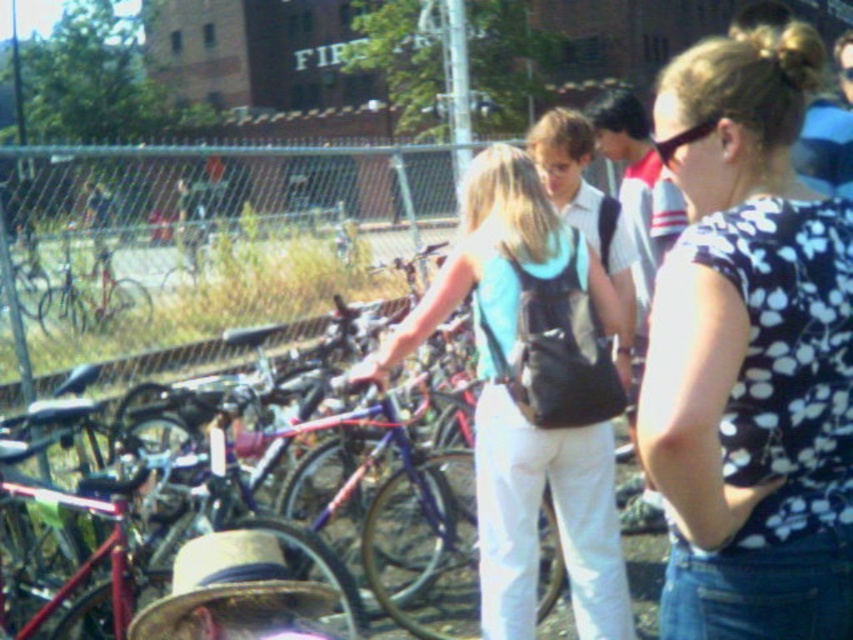
You are standing in the outdoor scene and see the floral print shirt at center and the light blue fabric backpack at center. Which item is positioned higher relative to the other?

The floral print shirt at center is above the light blue fabric backpack at center, so it is positioned higher.

You are standing at the point closest to the camera in the scene. There are two points marked in the image, one at coordinates point (x=509, y=480) and the other at point (x=279, y=620). Which point are you currently standing at?

You are standing at point (x=279, y=620) because it is closer to the camera than point (x=509, y=480).

You are a delivery person who needs to place a package on top of the light blue fabric backpack at center and the strawtexturehat at lower left. Which object can the package be placed on without falling off?

The package can be placed on the light blue fabric backpack at center because it has a greater height compared to the strawtexturehat at lower left, providing a more stable surface.